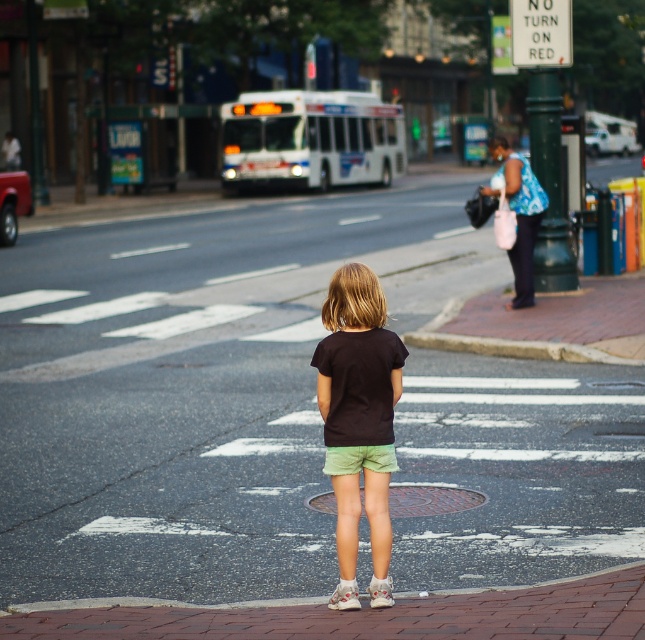
Question: Is smooth asphalt road at center closer to the viewer compared to matte black shirt at center?

Choices:
 (A) no
 (B) yes

Answer: (A)

Question: Which point is closer to the camera?

Choices:
 (A) (362, 444)
 (B) (212, 298)

Answer: (A)

Question: Is smooth asphalt road at center to the left of matte black shirt at center from the viewer's perspective?

Choices:
 (A) yes
 (B) no

Answer: (A)

Question: Which point is farther from the camera taking this photo?

Choices:
 (A) (579, 417)
 (B) (359, 458)

Answer: (A)

Question: Which object appears farthest from the camera in this image?

Choices:
 (A) smooth asphalt road at center
 (B) matte black shirt at center

Answer: (A)

Question: Is the position of smooth asphalt road at center less distant than that of matte black shirt at center?

Choices:
 (A) no
 (B) yes

Answer: (A)